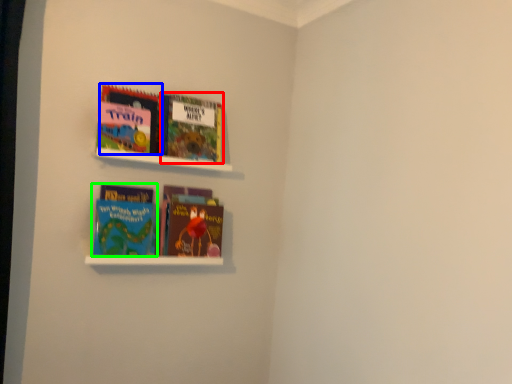
Question: Which object is the closest to the book (highlighted by a red box)? Choose among these: book (highlighted by a blue box) or book (highlighted by a green box).

Choices:
 (A) book
 (B) book

Answer: (A)